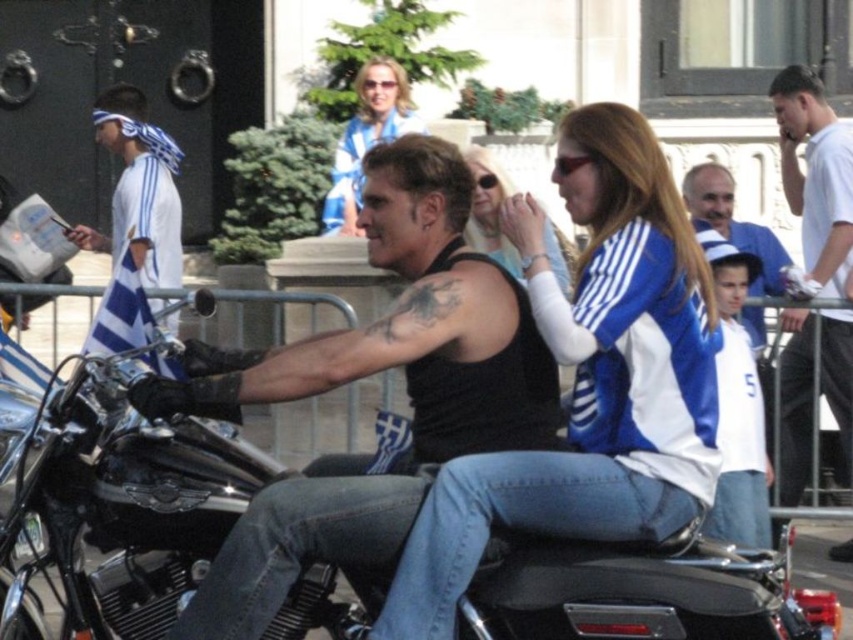
You are standing in the crowd watching the motorcycle riders. You notice two points in the scene at coordinates point (418, 451) and point (376, 96). Which point is closer to you?

Point (418, 451) is closer to the viewer than point (376, 96).

You are a photographer standing at the center of the scene. You want to take a photo of the white fabric headband at left and the matte blue and white jersey at center. How far apart are these two objects in feet?

The white fabric headband at left is 29.40 feet from matte blue and white jersey at center.

You are a photographer at the event and need to capture both the white fabric headband at left and the matte blue and white jersey at center in your shot. Which object should you focus on first to ensure both are in frame?

You should focus on the white fabric headband at left first because it is larger in size compared to the matte blue and white jersey at center, ensuring it fits within the frame while the smaller jersey remains visible.